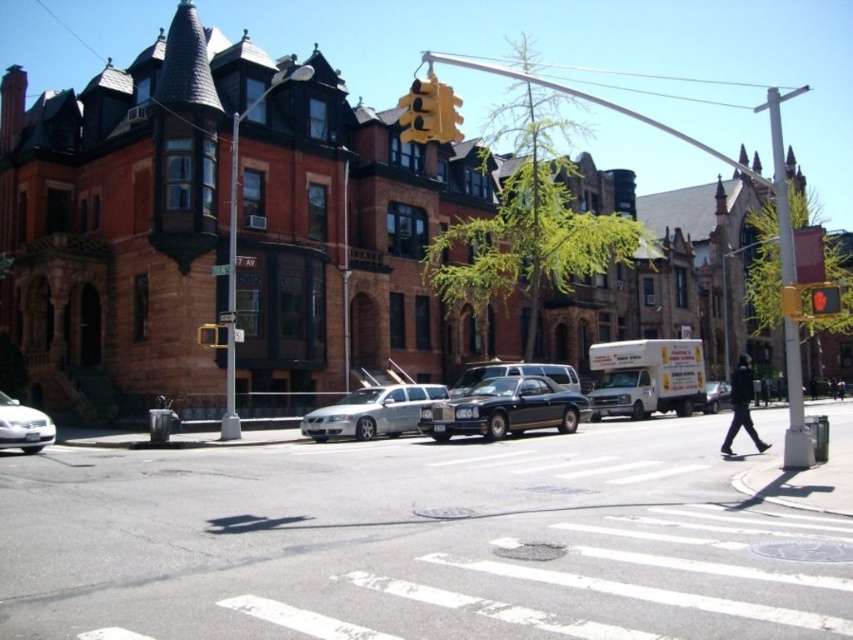
You are a delivery person who needs to park your 2.5 meter tall delivery van. You see the glossy black car at center and the white plastic pole at right. Which object is shorter and can your van park without hitting it?

The glossy black car at center is shorter than the white plastic pole at right. Since the van is 2.5 meters tall, it can park without hitting the glossy black car at center, but may hit the taller white plastic pole at right if not careful.

You are a delivery person trying to park your 2.5 meters wide truck in the parking spot next to the silver metallic sedan at center and the yellow metallic traffic light at upper center. According to the scene, can your truck fit in the parking spot between them?

The silver metallic sedan at center is wider than the yellow metallic traffic light at upper center. However, the parking spot width isn generated from the provided information. Therefore, it is impossible to determine if the truck will fit based on the given data.

You are a pedestrian waiting at the crosswalk. You see a silver metallic sedan at center and a yellow metallic traffic light at upper center. Which object is closer to the left side of the crosswalk?

The silver metallic sedan at center is to the left of the yellow metallic traffic light at upper center, so it is closer to the left side of the crosswalk.